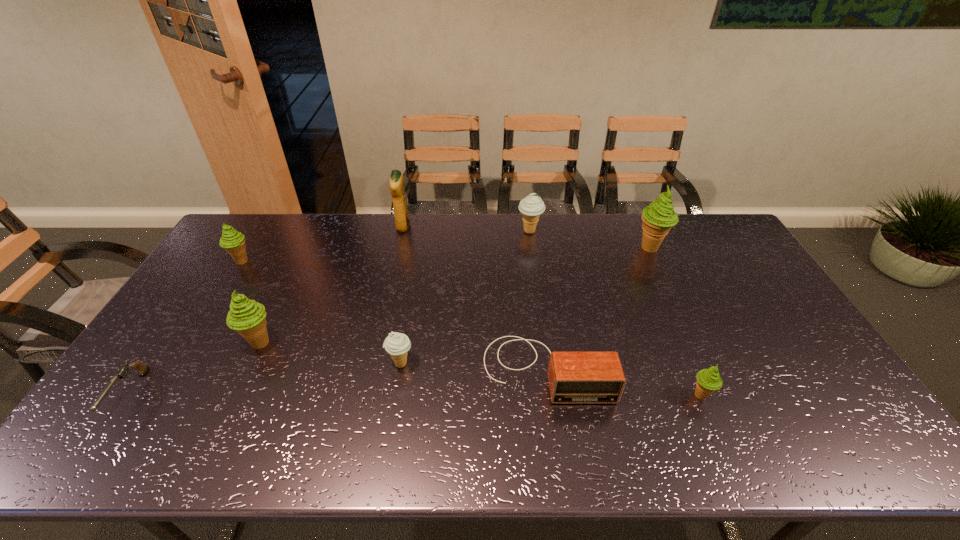
Identify which icecream is the fourth nearest to the third icecream from left to right. Please provide its 2D coordinates. Your answer should be formatted as a tuple, i.e. [(x, y)], where the tuple contains the x and y coordinates of a point satisfying the conditions above.

[(708, 380)]

Point out which icecream is positioned as the fourth nearest to the third icecream from right to left. Please provide its 2D coordinates. Your answer should be formatted as a tuple, i.e. [(x, y)], where the tuple contains the x and y coordinates of a point satisfying the conditions above.

[(248, 317)]

Locate which green icecream is the third closest to the shortest object. Please provide its 2D coordinates. Your answer should be formatted as a tuple, i.e. [(x, y)], where the tuple contains the x and y coordinates of a point satisfying the conditions above.

[(708, 380)]

This screenshot has height=540, width=960. Identify the location of green icecream that is the closest to the third icecream from left to right. (248, 317).

Locate an element on the screen. The image size is (960, 540). vacant area that satisfies the following two spatial constraints: 1. aiming along the barrel of the gun; 2. on the right side of the nearest green icecream is located at coordinates (128, 395).